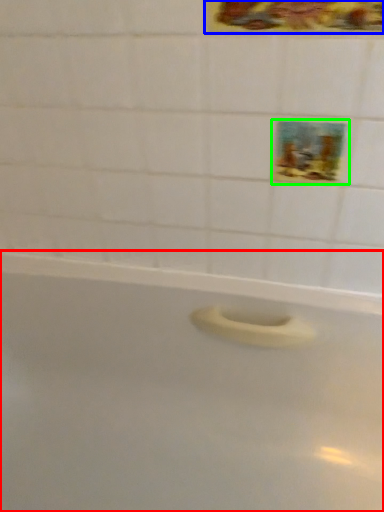
Question: Which object is the closest to the bathtub (highlighted by a red box)? Choose among these: decorative picture (highlighted by a blue box) or decorative picture (highlighted by a green box).

Choices:
 (A) decorative picture
 (B) decorative picture

Answer: (B)